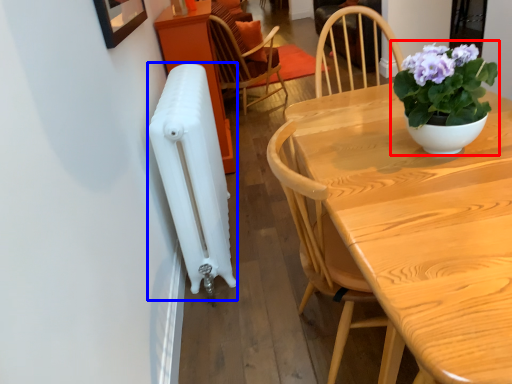
Question: Which of the following is the closest to the observer, houseplant (highlighted by a red box) or radiator (highlighted by a blue box)?

Choices:
 (A) houseplant
 (B) radiator

Answer: (A)